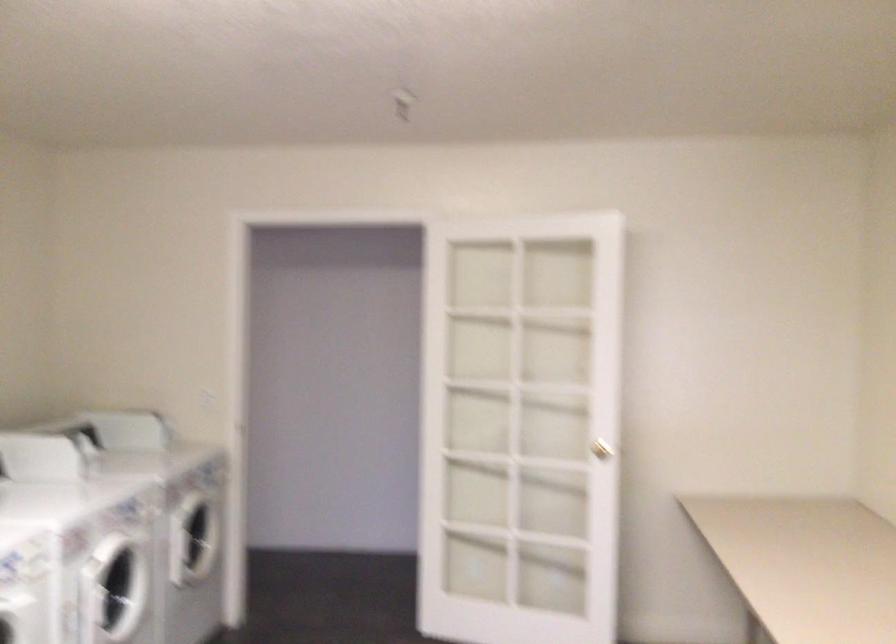
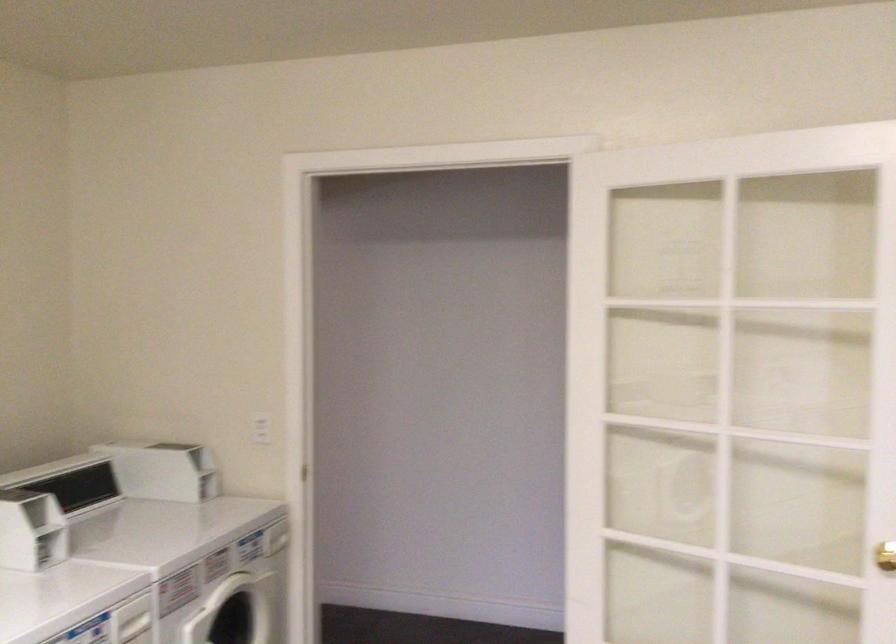
Locate, in the second image, the point that corresponds to [153,512] in the first image.

(133, 621)